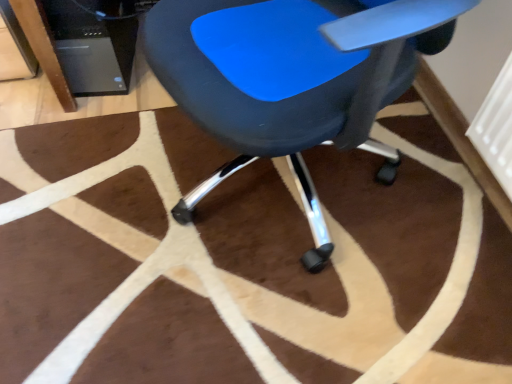
Question: From the image's perspective, is blue plastic chair at center positioned above or below black plastic computer tower at upper left?

Choices:
 (A) above
 (B) below

Answer: (B)

Question: Is point (323, 8) closer or farther from the camera than point (79, 56)?

Choices:
 (A) closer
 (B) farther

Answer: (A)

Question: Based on their relative distances, which object is nearer to the blue plastic chair at center?

Choices:
 (A) brown fuzzy rug at center
 (B) black plastic computer tower at upper left

Answer: (A)

Question: Estimate the real-world distances between objects in this image. Which object is farther from the black plastic computer tower at upper left?

Choices:
 (A) blue plastic chair at center
 (B) brown fuzzy rug at center

Answer: (A)